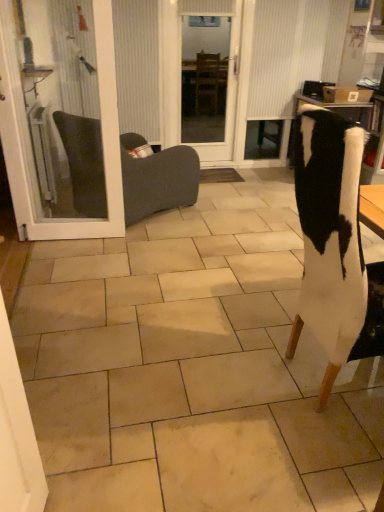
Image resolution: width=384 pixels, height=512 pixels. What are the coordinates of `free space that is in between white fur chair at right, which is counted as the first chair, starting from the front, and white glass door at left` in the screenshot? It's located at (175, 293).